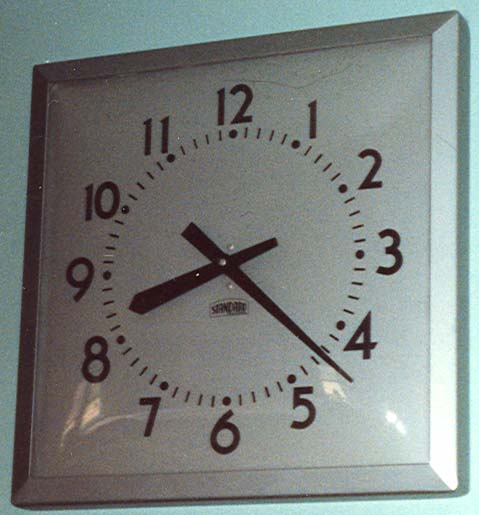
At what (x,y) coordinates should I click in order to perform the action: click on pastel green wall. Please return your answer as a coordinate pair (x, y). Image resolution: width=479 pixels, height=515 pixels. Looking at the image, I should click on (162, 18), (15, 164).